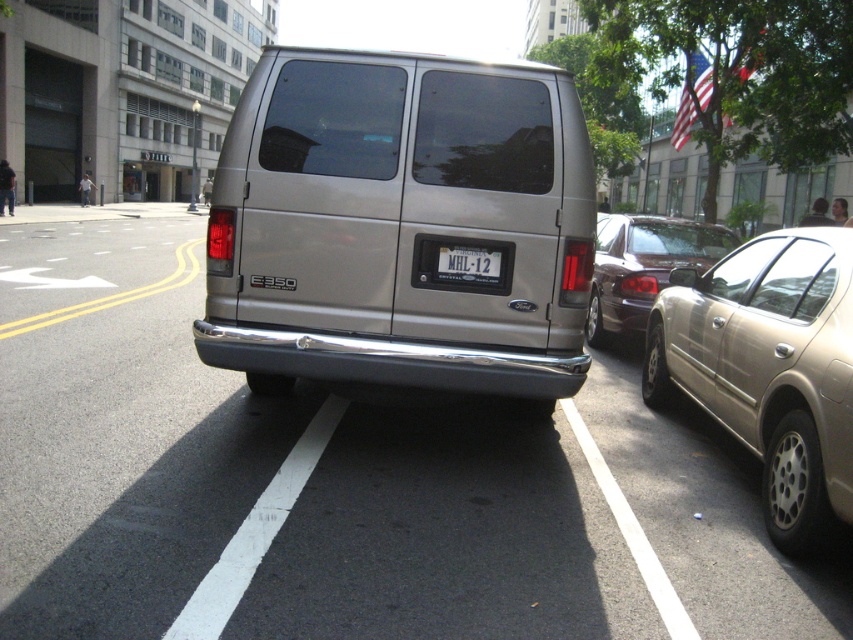
You are standing in front of the silver Ford E Series Super Duty van parked on the city street. You notice two points marked on the van. The first point is at coordinate [766,349] and the second point is at coordinate [701,241]. Which of these two points is closer to you?

Point [766,349] is closer to the viewer than point [701,241].